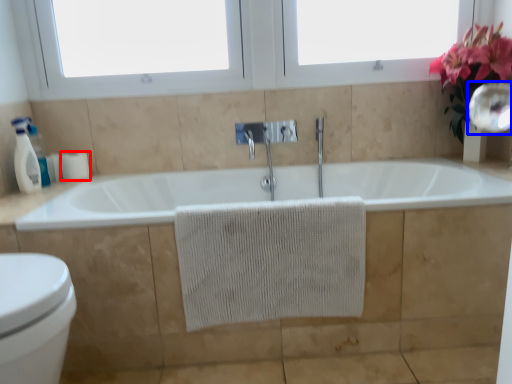
Question: Which object appears farthest to the camera in this image, toilet paper (highlighted by a red box) or mirror (highlighted by a blue box)?

Choices:
 (A) toilet paper
 (B) mirror

Answer: (A)